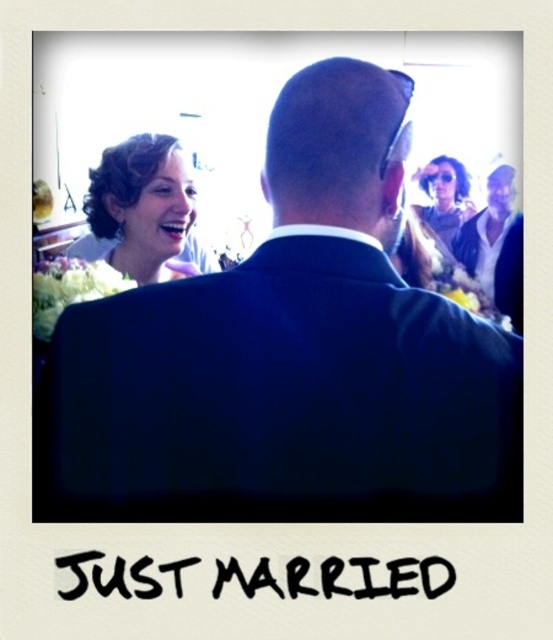
Question: Among these objects, which one is farthest from the camera?

Choices:
 (A) sunglasses at upper center
 (B) dark blue suit at center

Answer: (A)

Question: Can you confirm if blonde hair at upper left is smaller than sunglasses at upper center?

Choices:
 (A) yes
 (B) no

Answer: (A)

Question: Observing the image, what is the correct spatial positioning of blonde hair at upper left in reference to sunglasses at upper center?

Choices:
 (A) below
 (B) above

Answer: (A)

Question: Which object is the closest to the dark blue suit at center?

Choices:
 (A) sunglasses at upper center
 (B) blonde hair at upper left

Answer: (B)

Question: Which point is farther to the camera?

Choices:
 (A) sunglasses at upper center
 (B) blonde hair at upper left
 (C) dark blue suit at center

Answer: (A)

Question: Does blonde hair at upper left appear on the left side of sunglasses at upper center?

Choices:
 (A) yes
 (B) no

Answer: (A)